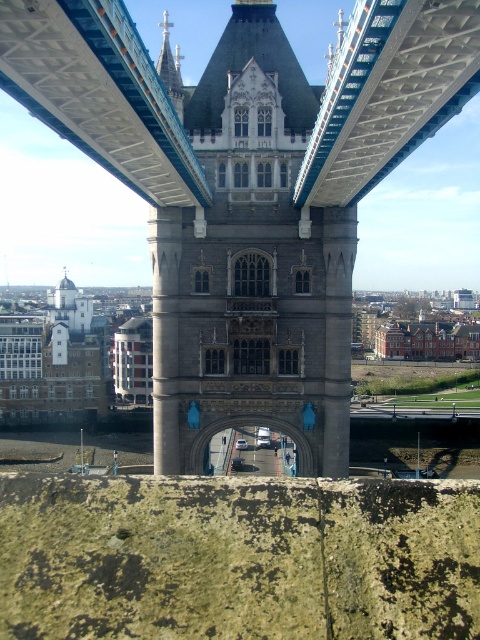
Which is behind, point (227, 168) or point (232, 394)?

The point (232, 394) is behind.

Find the location of a particular element. stone archway at center is located at coordinates (247, 192).